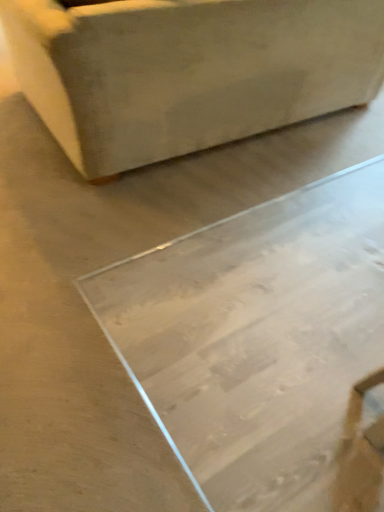
Question: Considering the positions of matte beige ottoman at upper left and transparent glass table at center in the image, is matte beige ottoman at upper left bigger or smaller than transparent glass table at center?

Choices:
 (A) small
 (B) big

Answer: (B)

Question: In terms of width, does matte beige ottoman at upper left look wider or thinner when compared to transparent glass table at center?

Choices:
 (A) thin
 (B) wide

Answer: (A)

Question: In the image, is matte beige ottoman at upper left positioned in front of or behind transparent glass table at center?

Choices:
 (A) front
 (B) behind

Answer: (B)

Question: Is transparent glass table at center inside or outside of matte beige ottoman at upper left?

Choices:
 (A) inside
 (B) outside

Answer: (B)

Question: From a real-world perspective, relative to matte beige ottoman at upper left, is transparent glass table at center vertically above or below?

Choices:
 (A) below
 (B) above

Answer: (A)

Question: Is transparent glass table at center taller or shorter than matte beige ottoman at upper left?

Choices:
 (A) tall
 (B) short

Answer: (B)

Question: Would you say transparent glass table at center is to the left or to the right of matte beige ottoman at upper left in the picture?

Choices:
 (A) right
 (B) left

Answer: (A)